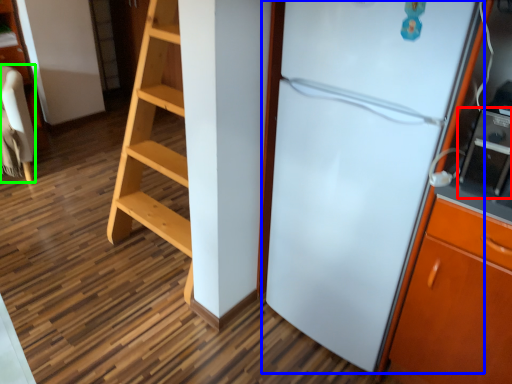
Question: Which is farther away from appliance (highlighted by a red box)? refrigerator (highlighted by a blue box) or furniture (highlighted by a green box)?

Choices:
 (A) refrigerator
 (B) furniture

Answer: (B)